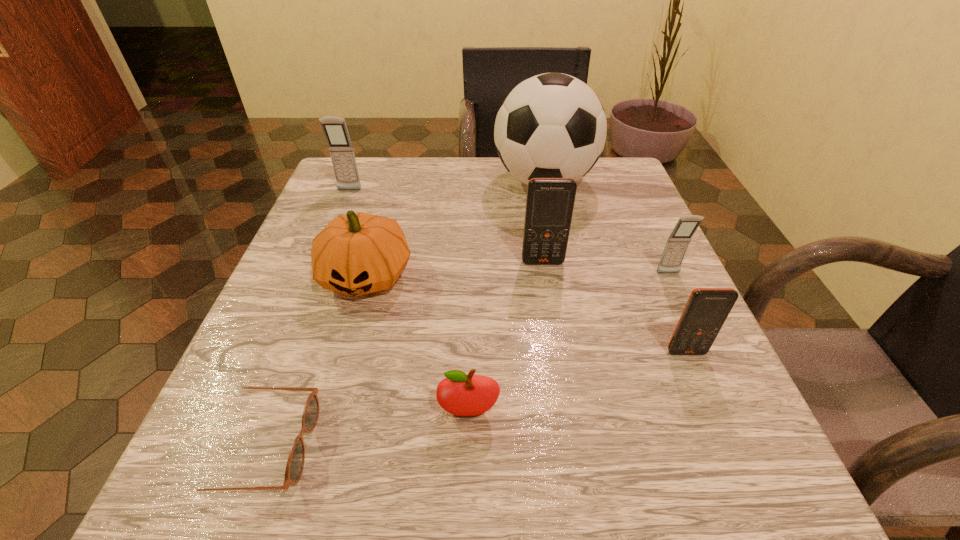
Locate an element on the screen. This screenshot has width=960, height=540. object present at the far left corner is located at coordinates (335, 130).

Locate an element on the screen. This screenshot has height=540, width=960. object that is at the near left corner is located at coordinates (295, 463).

What are the coordinates of `object that is positioned at the far right corner` in the screenshot? It's located at (553, 125).

Locate an element on the screen. The image size is (960, 540). vacant region at the far edge of the desktop is located at coordinates (517, 180).

At what (x,y) coordinates should I click in order to perform the action: click on vacant space at the left edge of the desktop. Please return your answer as a coordinate pair (x, y). Looking at the image, I should click on (x=253, y=425).

The height and width of the screenshot is (540, 960). In the image, there is a desktop. What are the coordinates of `vacant region at the right edge` in the screenshot? It's located at (623, 245).

Locate an element on the screen. vacant space at the far left corner of the desktop is located at coordinates (372, 201).

The image size is (960, 540). In the image, there is a desktop. Find the location of `vacant space at the far right corner`. vacant space at the far right corner is located at coordinates (605, 202).

In the image, there is a desktop. Identify the location of vacant space at the near right corner. (752, 450).

This screenshot has height=540, width=960. I want to click on free spot between the nearest cellular telephone and the third nearest cellular telephone, so click(614, 307).